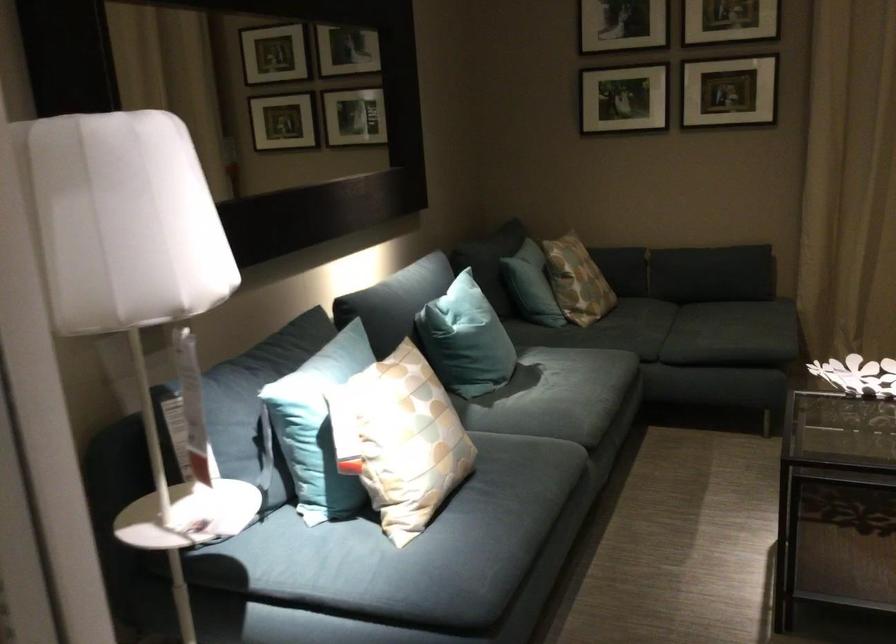
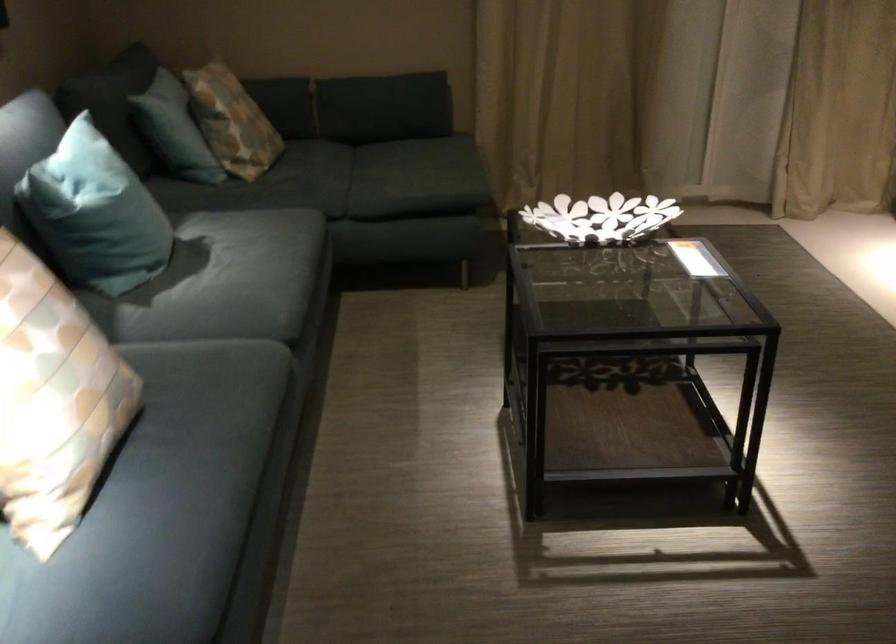
Find the pixel in the second image that matches (x=502, y=496) in the first image.

(197, 436)